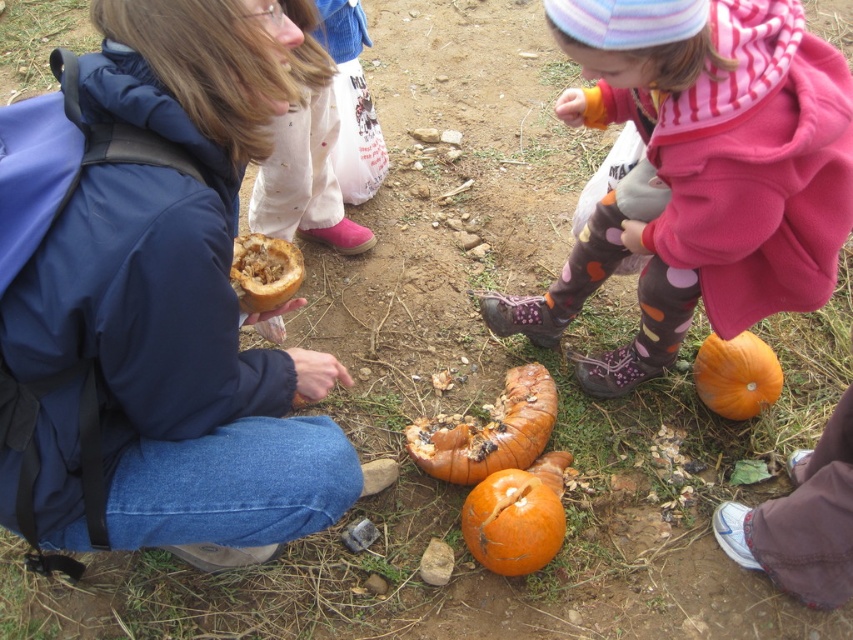
You are a photographer trying to capture the polka dot leggings at lower center and the rotten pumpkin at center in the same frame. Based on their positions, can you tell which object is closer to the camera?

The polka dot leggings at lower center is located above the rotten pumpkin at center, so the polka dot leggings at lower center is closer to the camera.

You are standing in the pumpkin patch and see two points marked in the scene. Which point is closer to you, point [556,316] or point [505,413]?

Point [505,413] is closer to you because it is less further to the camera than point [556,316].

You are trying to determine the relative sizes of objects in the scene. Which object is thinner between the matte brown pumpkin at center and the polka dot leggings at lower center?

The matte brown pumpkin at center is thinner than the polka dot leggings at lower center according to the description.